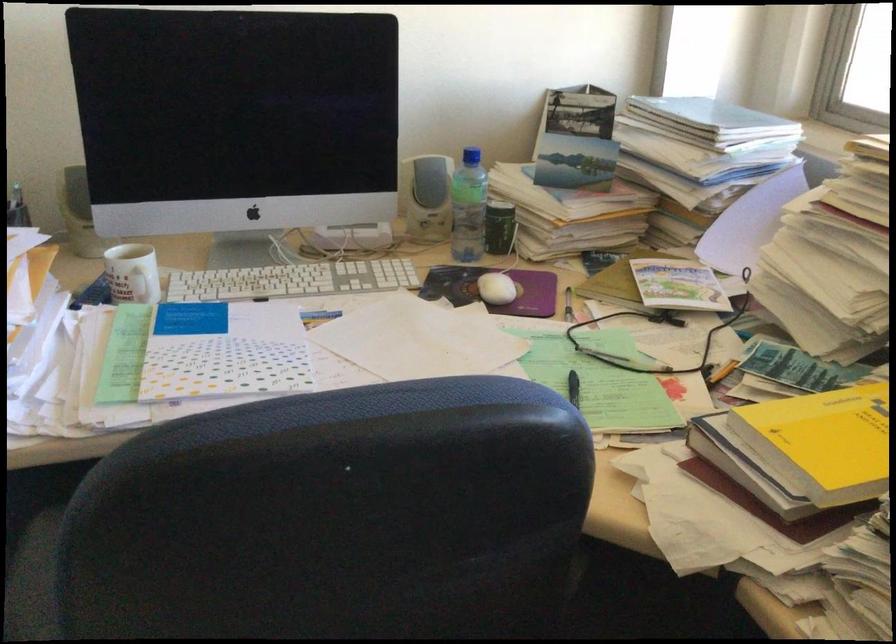
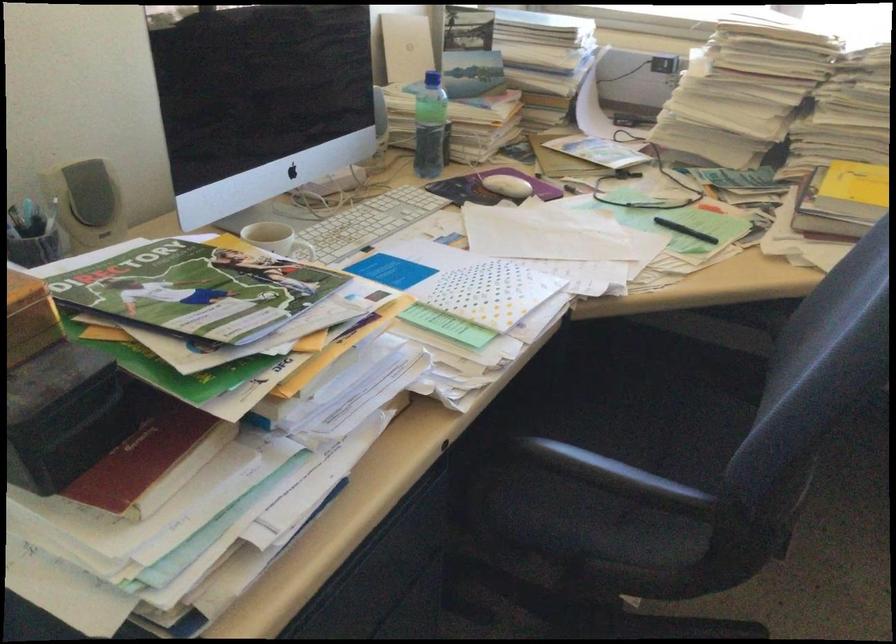
Where in the second image is the point corresponding to (650,301) from the first image?

(610, 166)